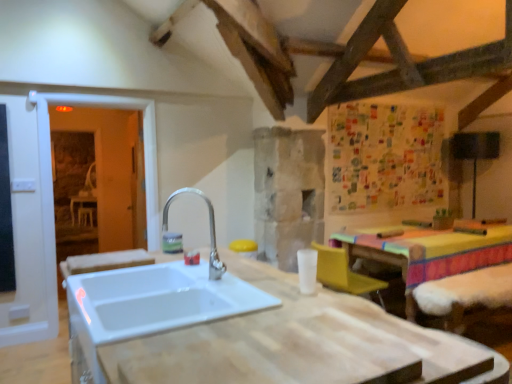
Question: From a real-world perspective, is transparent glass door at left over white ceramic sink at center?

Choices:
 (A) yes
 (B) no

Answer: (B)

Question: Can we say transparent glass door at left lies outside white ceramic sink at center?

Choices:
 (A) no
 (B) yes

Answer: (B)

Question: Is transparent glass door at left to the right of white ceramic sink at center from the viewer's perspective?

Choices:
 (A) yes
 (B) no

Answer: (B)

Question: From the image's perspective, would you say transparent glass door at left is positioned over white ceramic sink at center?

Choices:
 (A) no
 (B) yes

Answer: (B)

Question: Is transparent glass door at left taller than white ceramic sink at center?

Choices:
 (A) no
 (B) yes

Answer: (B)

Question: Is transparent glass door at left behind white ceramic sink at center?

Choices:
 (A) no
 (B) yes

Answer: (B)

Question: Does yellow plastic armchair at lower right have a lesser width compared to white ceramic sink at center?

Choices:
 (A) no
 (B) yes

Answer: (B)

Question: Does yellow plastic armchair at lower right have a greater height compared to white ceramic sink at center?

Choices:
 (A) no
 (B) yes

Answer: (A)

Question: Considering the relative positions of yellow plastic armchair at lower right and white ceramic sink at center in the image provided, is yellow plastic armchair at lower right behind white ceramic sink at center?

Choices:
 (A) yes
 (B) no

Answer: (A)

Question: Is yellow plastic armchair at lower right located outside white ceramic sink at center?

Choices:
 (A) yes
 (B) no

Answer: (A)

Question: Considering the relative sizes of yellow plastic armchair at lower right and white ceramic sink at center in the image provided, is yellow plastic armchair at lower right bigger than white ceramic sink at center?

Choices:
 (A) yes
 (B) no

Answer: (B)

Question: From a real-world perspective, does yellow plastic armchair at lower right sit lower than white ceramic sink at center?

Choices:
 (A) yes
 (B) no

Answer: (A)

Question: Does white wood countertop at center have a greater width compared to white ceramic sink at center?

Choices:
 (A) yes
 (B) no

Answer: (A)